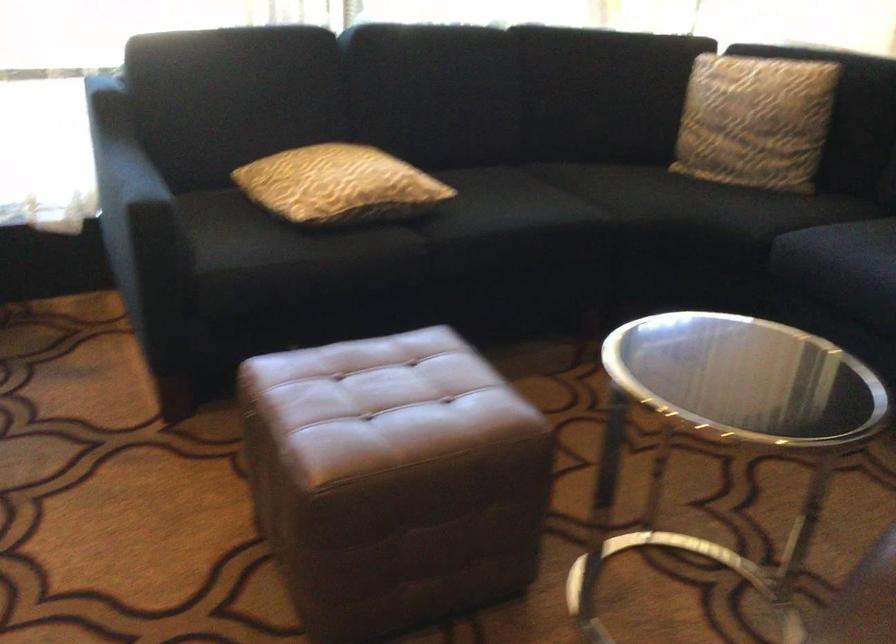
This screenshot has width=896, height=644. Describe the element at coordinates (392, 480) in the screenshot. I see `a brown leather ottoman` at that location.